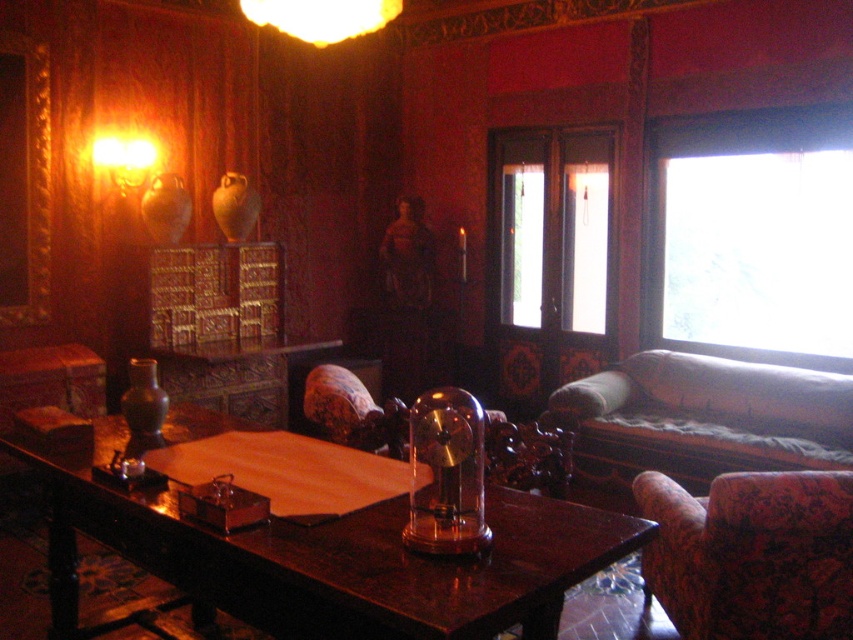
You are standing in the study and want to place a new lamp on the shiny dark wood table at center. According to the coordinates provided, where exactly should you place the lamp?

The shiny dark wood table at center is located at coordinates point (329,557), so you should place the lamp there.

You are a guest in this study and need to place a tall lamp on the shiny dark wood table at center and the velvet beige couch at right. Which surface can accommodate the lamp without it toppling over?

The shiny dark wood table at center is taller than the velvet beige couch at right, so placing the tall lamp on the shiny dark wood table at center would be more stable and less likely to topple over due to its greater height providing a more secure base.

In the scene shown: You are sitting in the floral fabric armchair at lower right and want to reach the matte glass lamp at upper left. Which direction should you move to get closer to the lamp?

The floral fabric armchair at lower right is positioned on the right side of the matte glass lamp at upper left, so to move closer to the lamp, you should move to the left.